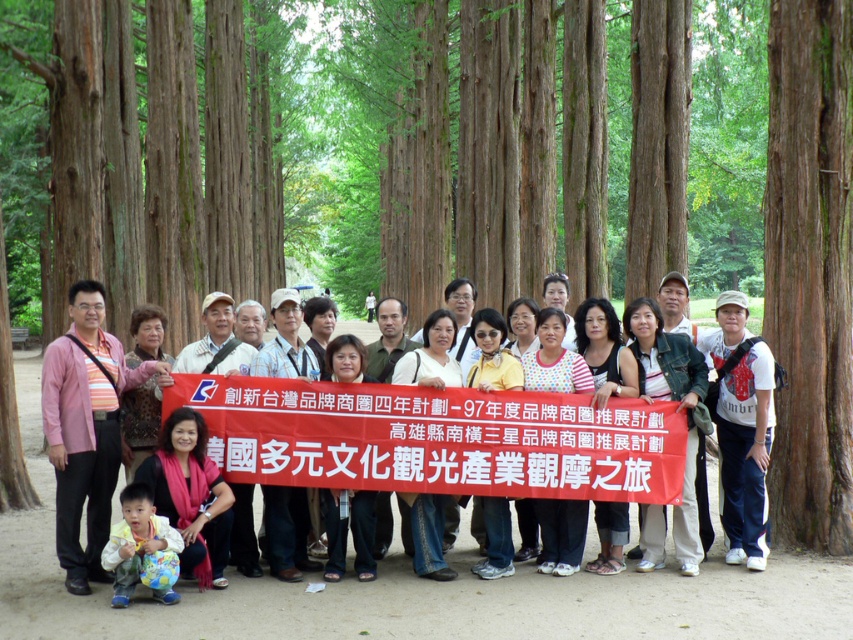
Question: Observing the image, what is the correct spatial positioning of brown rough bark tree at right in reference to white cotton shirt at center?

Choices:
 (A) left
 (B) right

Answer: (B)

Question: Can you confirm if matte yellow sign at center is wider than brown rough bark tree at right?

Choices:
 (A) no
 (B) yes

Answer: (B)

Question: Which of these objects is positioned farthest from the matte yellow sign at center?

Choices:
 (A) white cotton shirt at center
 (B) brown rough bark tree at right

Answer: (B)

Question: Does matte yellow sign at center appear under white cotton shirt at center?

Choices:
 (A) yes
 (B) no

Answer: (B)

Question: Which of the following is the closest to the observer?

Choices:
 (A) coord(799,413)
 (B) coord(161,544)

Answer: (B)

Question: Which object is the closest to the brown rough bark tree at right?

Choices:
 (A) matte yellow sign at center
 (B) light blue fabric at lower left

Answer: (A)